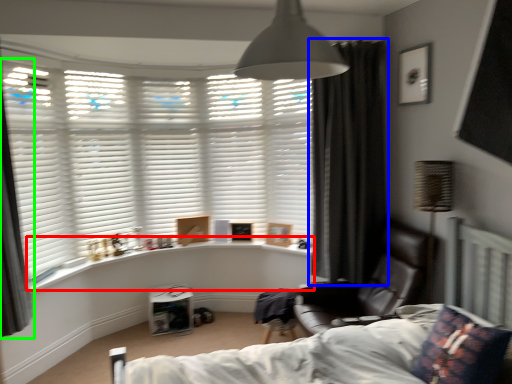
Question: Based on their relative distances, which object is nearer to window sill (highlighted by a red box)? Choose from curtain (highlighted by a blue box) and curtain (highlighted by a green box).

Choices:
 (A) curtain
 (B) curtain

Answer: (B)